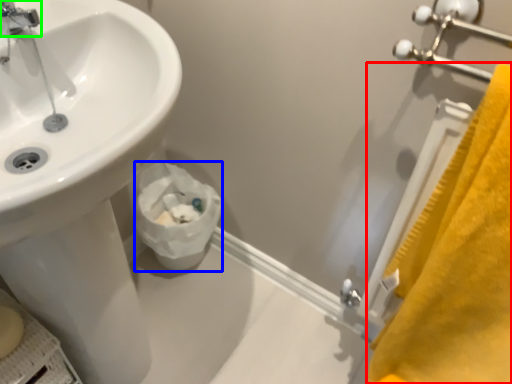
Question: Based on their relative distances, which object is farther from bath towel (highlighted by a red box)? Choose from toilet paper (highlighted by a blue box) and tap (highlighted by a green box).

Choices:
 (A) toilet paper
 (B) tap

Answer: (B)